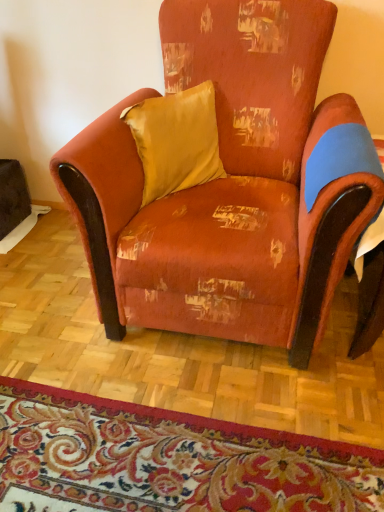
Question: From the image's perspective, would you say floral carpet at lower center is positioned over satin yellow pillow at upper center?

Choices:
 (A) yes
 (B) no

Answer: (B)

Question: Is floral carpet at lower center closer to camera compared to satin yellow pillow at upper center?

Choices:
 (A) no
 (B) yes

Answer: (B)

Question: From a real-world perspective, is floral carpet at lower center over satin yellow pillow at upper center?

Choices:
 (A) no
 (B) yes

Answer: (A)

Question: Can you confirm if floral carpet at lower center is wider than satin yellow pillow at upper center?

Choices:
 (A) no
 (B) yes

Answer: (B)

Question: Is floral carpet at lower center completely or partially outside of satin yellow pillow at upper center?

Choices:
 (A) no
 (B) yes

Answer: (B)

Question: From a real-world perspective, is floral carpet at lower center physically below satin yellow pillow at upper center?

Choices:
 (A) no
 (B) yes

Answer: (B)

Question: Is satin yellow pillow at upper center facing towards distressed orange fabric armchair at center?

Choices:
 (A) yes
 (B) no

Answer: (A)

Question: Can you confirm if satin yellow pillow at upper center is wider than distressed orange fabric armchair at center?

Choices:
 (A) no
 (B) yes

Answer: (A)

Question: Is satin yellow pillow at upper center thinner than distressed orange fabric armchair at center?

Choices:
 (A) yes
 (B) no

Answer: (A)

Question: Does satin yellow pillow at upper center have a smaller size compared to distressed orange fabric armchair at center?

Choices:
 (A) no
 (B) yes

Answer: (B)

Question: Is satin yellow pillow at upper center bigger than distressed orange fabric armchair at center?

Choices:
 (A) no
 (B) yes

Answer: (A)

Question: Does satin yellow pillow at upper center contain distressed orange fabric armchair at center?

Choices:
 (A) no
 (B) yes

Answer: (A)

Question: From the image's perspective, is floral carpet at lower center located beneath distressed orange fabric armchair at center?

Choices:
 (A) no
 (B) yes

Answer: (B)